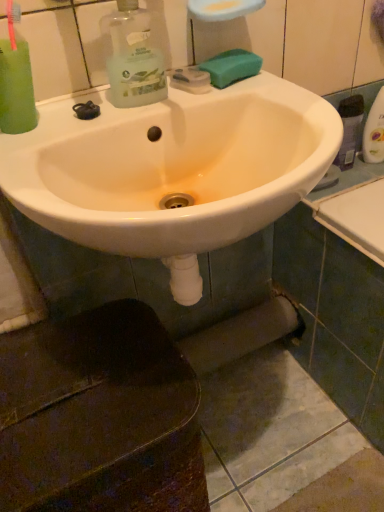
This screenshot has height=512, width=384. Find the location of `free space in front of green sponge at upper right`. free space in front of green sponge at upper right is located at coordinates (240, 98).